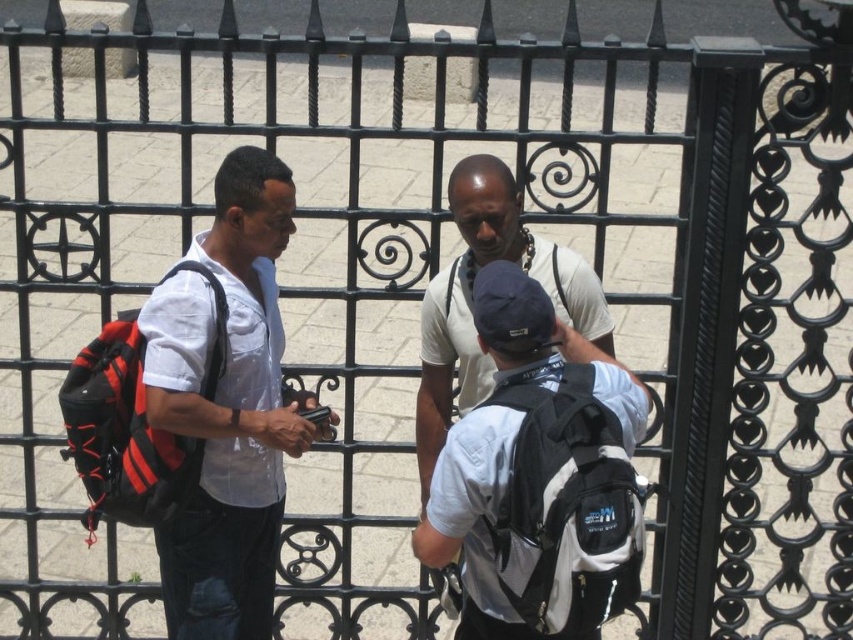
Does white matte backpack at center have a greater height compared to white matte shirt at center?

Incorrect, white matte backpack at center's height is not larger of white matte shirt at center's.

Does white matte backpack at center have a lesser height compared to white matte shirt at center?

Indeed, white matte backpack at center has a lesser height compared to white matte shirt at center.

The image size is (853, 640). What do you see at coordinates (566, 508) in the screenshot?
I see `white matte backpack at center` at bounding box center [566, 508].

At what (x,y) coordinates should I click in order to perform the action: click on white matte backpack at center. Please return your answer as a coordinate pair (x, y). The height and width of the screenshot is (640, 853). Looking at the image, I should click on (566, 508).

Between matte white shirt at center and white matte shirt at center, which one is positioned lower?

matte white shirt at center is below.

The height and width of the screenshot is (640, 853). What do you see at coordinates (227, 406) in the screenshot? I see `matte white shirt at center` at bounding box center [227, 406].

Identify the location of matte white shirt at center. (227, 406).

Does point (497, 518) come closer to viewer compared to point (184, 468)?

That is True.

Between white matte backpack at center and red and black fabric backpack at left, which one is positioned higher?

Positioned higher is red and black fabric backpack at left.

This screenshot has height=640, width=853. What do you see at coordinates (566, 508) in the screenshot? I see `white matte backpack at center` at bounding box center [566, 508].

Identify the location of white matte backpack at center. Image resolution: width=853 pixels, height=640 pixels. (566, 508).